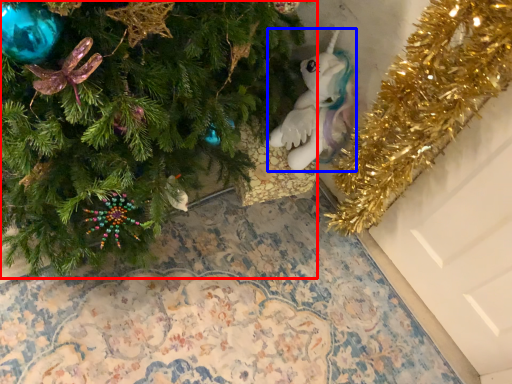
Question: Which object is closer to the camera taking this photo, christmas tree (highlighted by a red box) or toy (highlighted by a blue box)?

Choices:
 (A) christmas tree
 (B) toy

Answer: (A)